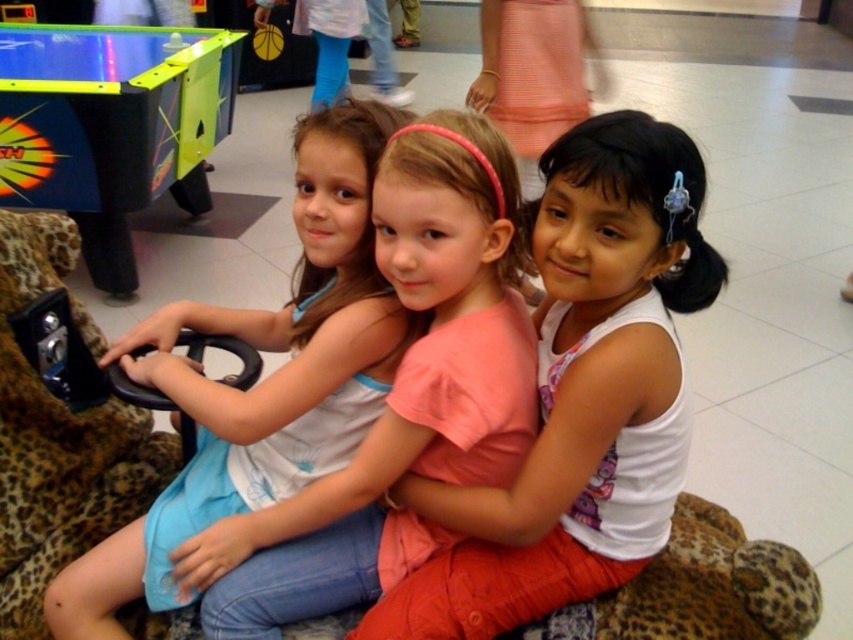
Is point (399, 604) farther from viewer compared to point (154, 584)?

No, (399, 604) is closer to viewer.

Is pink cotton shirt at center taller than pink fabric dress at center?

In fact, pink cotton shirt at center may be shorter than pink fabric dress at center.

You are a GUI agent. You are given a task and a screenshot of the screen. Output one action in this format:
    pyautogui.click(x=<x>, y=<y>)
    Task: Click on the pink cotton shirt at center
    The width and height of the screenshot is (853, 640).
    Given the screenshot: What is the action you would take?
    pyautogui.click(x=579, y=396)